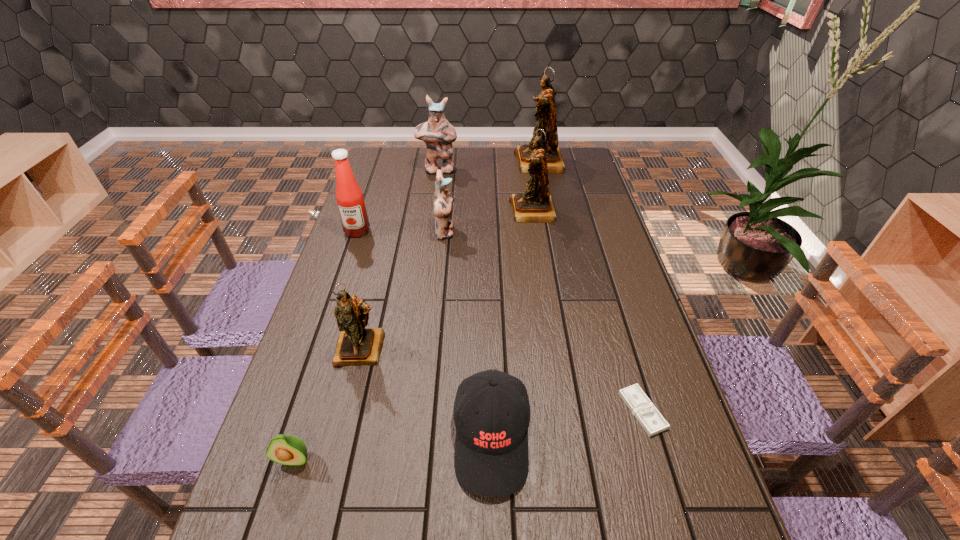
Where is `the shortest object`? the shortest object is located at coordinates (651, 420).

Locate an element on the screen. Image resolution: width=960 pixels, height=540 pixels. vacant space positioned 0.090m on the front-facing side of the tallest figurine is located at coordinates (493, 163).

The width and height of the screenshot is (960, 540). In order to click on vacant space situated 0.060m on the front-facing side of the tallest figurine in this screenshot , I will do `click(500, 163)`.

At what (x,y) coordinates should I click in order to perform the action: click on free spot located on the front-facing side of the tallest figurine. Please return your answer as a coordinate pair (x, y). This screenshot has width=960, height=540. Looking at the image, I should click on (458, 163).

Locate an element on the screen. The height and width of the screenshot is (540, 960). vacant space located 0.310m on the front-facing side of the second biggest gold figurine is located at coordinates (423, 211).

Locate an element on the screen. The image size is (960, 540). vacant space located 0.320m on the front-facing side of the second biggest gold figurine is located at coordinates (420, 211).

Where is `vacant position located on the front-facing side of the second biggest gold figurine`? Image resolution: width=960 pixels, height=540 pixels. vacant position located on the front-facing side of the second biggest gold figurine is located at coordinates (410, 211).

The width and height of the screenshot is (960, 540). Find the location of `vacant area situated 0.330m on the front-facing side of the bigger pink figurine`. vacant area situated 0.330m on the front-facing side of the bigger pink figurine is located at coordinates (431, 225).

Image resolution: width=960 pixels, height=540 pixels. Find the location of `vacant region located 0.200m on the front-facing side of the condiment`. vacant region located 0.200m on the front-facing side of the condiment is located at coordinates [x=341, y=280].

You are a GUI agent. You are given a task and a screenshot of the screen. Output one action in this format:
    pyautogui.click(x=<x>, y=<y>)
    Task: Click on the free space located on the front-facing side of the nearer pink figurine
    The width and height of the screenshot is (960, 540).
    Given the screenshot: What is the action you would take?
    pyautogui.click(x=541, y=232)